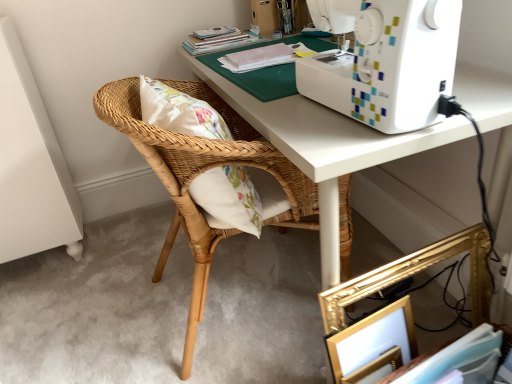
Question: Does point (199, 41) appear closer or farther from the camera than point (340, 263)?

Choices:
 (A) farther
 (B) closer

Answer: (A)

Question: From the image's perspective, relative to woven wood chair at center, is hardcover book at upper center, the first book from the back, above or below?

Choices:
 (A) above
 (B) below

Answer: (A)

Question: Which of these objects is positioned closest to the white paper book at lower right, positioned as the first book in right-to-left order?

Choices:
 (A) hardcover book at upper center, which is the third book in bottom-to-top order
 (B) matte white book at upper center, the second book in the right-to-left sequence
 (C) woven wood chair at center
 (D) white matte sewing machine at upper right
 (E) white plastic sewing machine at upper right

Answer: (D)

Question: Estimate the real-world distances between objects in this image. Which object is closer to the white matte sewing machine at upper right?

Choices:
 (A) white paper book at lower right, positioned as the first book in right-to-left order
 (B) hardcover book at upper center, the first book in the top-to-bottom sequence
 (C) woven wood chair at center
 (D) matte white book at upper center, acting as the second book starting from the back
 (E) gold metallic picture frame at lower right

Answer: (C)